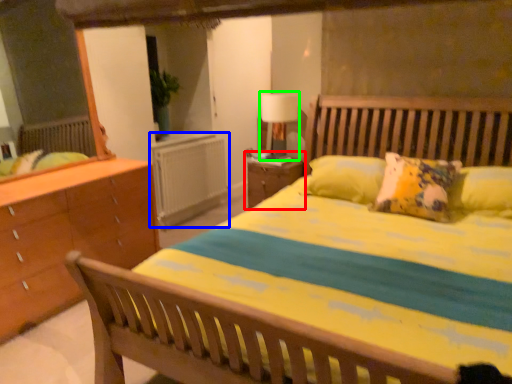
Question: Estimate the real-world distances between objects in this image. Which object is farther from nightstand (highlighted by a red box), radiator (highlighted by a blue box) or table lamp (highlighted by a green box)?

Choices:
 (A) radiator
 (B) table lamp

Answer: (A)